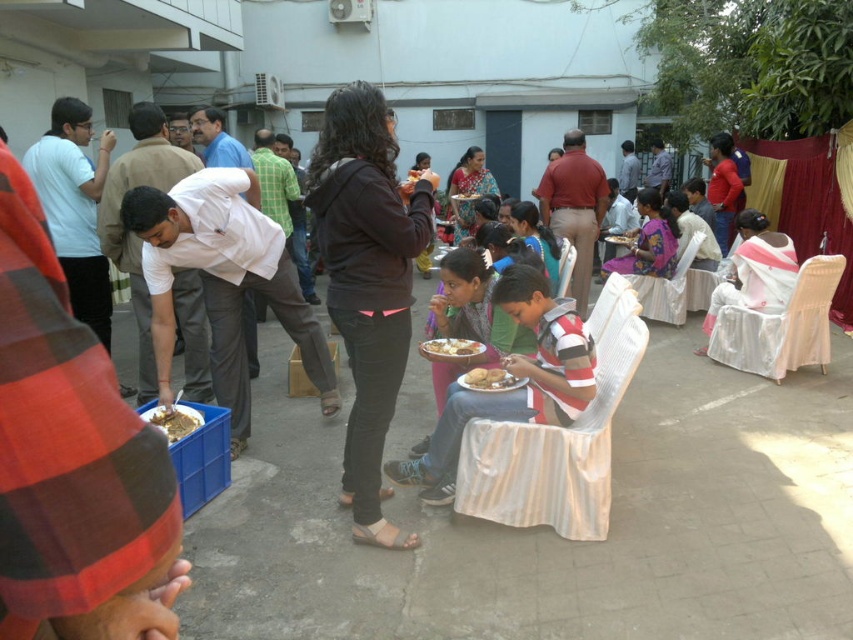
Is point (450, 477) positioned after point (450, 355)?

No, (450, 477) is closer to viewer.

Is striped cotton shirt at center wider than golden brown bread at center?

Yes.

Which is behind, point (502, 280) or point (445, 358)?

The point (445, 358) is behind.

At what (x,y) coordinates should I click in order to perform the action: click on striped cotton shirt at center. Please return your answer as a coordinate pair (x, y). This screenshot has height=640, width=853. Looking at the image, I should click on coord(514,376).

Which is in front, point (515, 397) or point (177, 433)?

Point (515, 397)

In order to click on striped cotton shirt at center in this screenshot , I will do `click(514, 376)`.

Who is shorter, dark brown leather jacket at center or striped cotton shirt at center?

With less height is striped cotton shirt at center.

Is dark brown leather jacket at center taller than striped cotton shirt at center?

Correct, dark brown leather jacket at center is much taller as striped cotton shirt at center.

This screenshot has width=853, height=640. What are the coordinates of `dark brown leather jacket at center` in the screenshot? It's located at (366, 284).